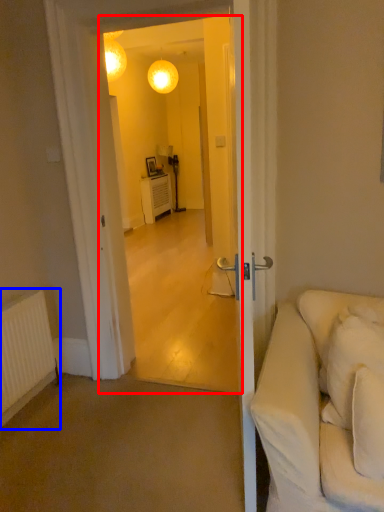
Question: Which of the following is the farthest to the observer, screen door (highlighted by a red box) or radiator (highlighted by a blue box)?

Choices:
 (A) screen door
 (B) radiator

Answer: (B)